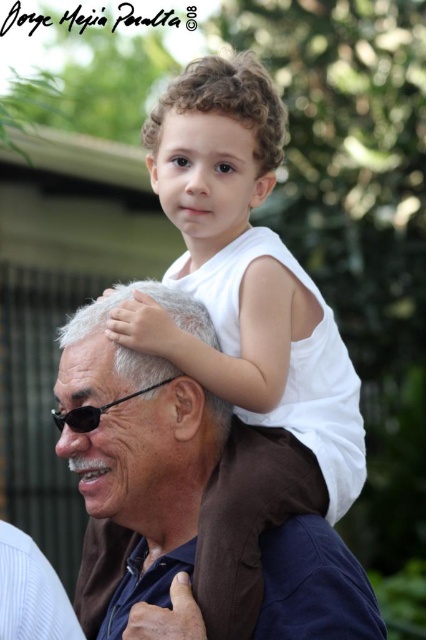
Is brown fabric at center to the left of black plastic goggles at center from the viewer's perspective?

No, brown fabric at center is not to the left of black plastic goggles at center.

Does brown fabric at center appear over black plastic goggles at center?

No, brown fabric at center is not above black plastic goggles at center.

What do you see at coordinates (135, 451) in the screenshot?
I see `brown fabric at center` at bounding box center [135, 451].

Locate an element on the screen. Image resolution: width=426 pixels, height=640 pixels. brown fabric at center is located at coordinates (135, 451).